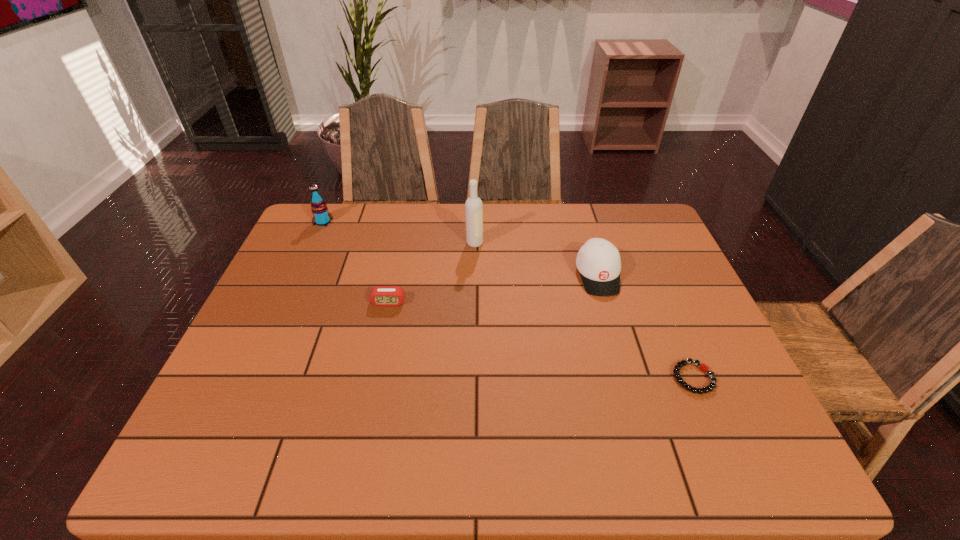
The height and width of the screenshot is (540, 960). In the image, there is a desktop. In order to click on vacant space at the far edge in this screenshot , I will do `click(519, 227)`.

You are a GUI agent. You are given a task and a screenshot of the screen. Output one action in this format:
    pyautogui.click(x=<x>, y=<y>)
    Task: Click on the free space at the near edge
    The image size is (960, 540).
    Given the screenshot: What is the action you would take?
    pyautogui.click(x=685, y=463)

Where is `free space at the left edge of the desktop`? The width and height of the screenshot is (960, 540). free space at the left edge of the desktop is located at coordinates (241, 409).

Identify the location of free space at the right edge of the desktop. (713, 343).

Locate an element on the screen. vacant space at the far right corner is located at coordinates (631, 209).

Image resolution: width=960 pixels, height=540 pixels. Find the location of `free spot between the nearest object and the soda`. free spot between the nearest object and the soda is located at coordinates (508, 300).

Find the location of a particular element. Image resolution: width=960 pixels, height=540 pixels. blank region between the fourth shortest object and the second object from left to right is located at coordinates (356, 262).

Find the location of a particular element. vacant area that lies between the fourth object from left to right and the soda is located at coordinates pos(461,248).

At what (x,y) coordinates should I click in order to perform the action: click on vacant area that lies between the vodka and the nearest object. Please return your answer as a coordinate pair (x, y). Image resolution: width=960 pixels, height=540 pixels. Looking at the image, I should click on (584, 310).

This screenshot has width=960, height=540. I want to click on vacant area between the soda and the shortest object, so click(508, 300).